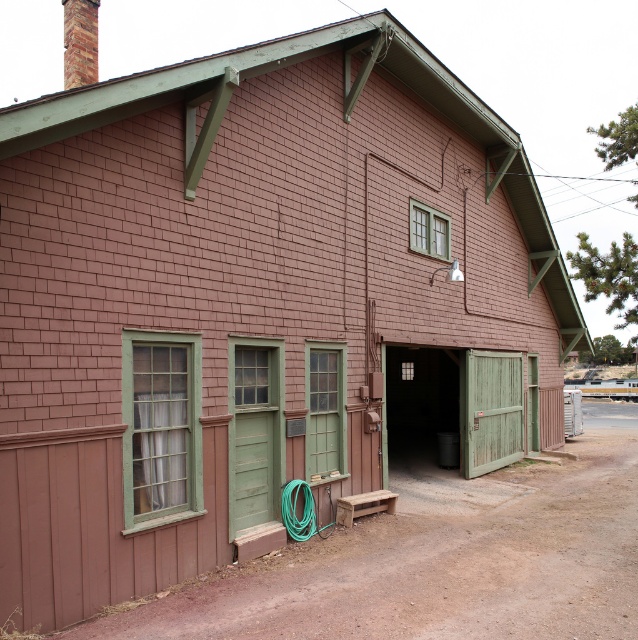
Question: Does green wooden door at center appear on the left side of green wood/glass garage door at lower right?

Choices:
 (A) yes
 (B) no

Answer: (A)

Question: Among these points, which one is farthest from the camera?

Choices:
 (A) (295, 520)
 (B) (491, 385)

Answer: (B)

Question: Considering the real-world distances, which object is closest to the green wooden door at center?

Choices:
 (A) green rubber hose at center
 (B) green wood/glass garage door at lower right

Answer: (B)

Question: Which of the following is the farthest from the observer?

Choices:
 (A) green wooden door at center
 (B) green rubber hose at center

Answer: (A)

Question: Is green wood/glass garage door at lower right in front of green rubber hose at center?

Choices:
 (A) no
 (B) yes

Answer: (A)

Question: Can you confirm if green wooden door at center is smaller than green wood/glass garage door at lower right?

Choices:
 (A) yes
 (B) no

Answer: (B)